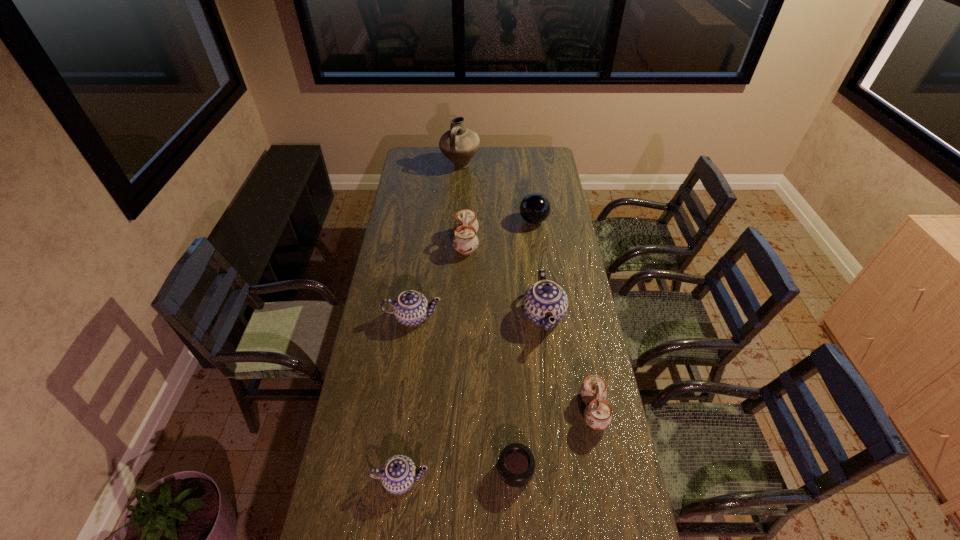
This screenshot has height=540, width=960. Identify the location of vacant space at the left edge of the desktop. (404, 197).

The width and height of the screenshot is (960, 540). I want to click on free space at the right edge of the desktop, so click(553, 343).

Locate an element on the screen. This screenshot has height=540, width=960. free space at the far left corner is located at coordinates (423, 159).

Locate an element on the screen. Image resolution: width=960 pixels, height=540 pixels. free spot between the second smallest blue chinaware and the fifth object from left to right is located at coordinates tap(464, 394).

Image resolution: width=960 pixels, height=540 pixels. Identify the location of vacant space that is in between the smallest blue chinaware and the pitcher. (430, 322).

Locate an element on the screen. The image size is (960, 540). blank region between the nearest blue chinaware and the fourth object from right to left is located at coordinates (458, 475).

Find the location of `free space between the fifth object from left to right and the farthest chinaware`. free space between the fifth object from left to right and the farthest chinaware is located at coordinates (491, 356).

At what (x,y) coordinates should I click in order to perform the action: click on vacant space that is in between the second smallest blue chinaware and the fourth farthest chinaware. Please return your answer as a coordinate pair (x, y). Looking at the image, I should click on [x=503, y=363].

Find the location of a particular element. free space that is in between the farthest chinaware and the biggest blue chinaware is located at coordinates (505, 279).

Find the location of a particular element. free area in between the fourth farthest chinaware and the tallest object is located at coordinates (527, 288).